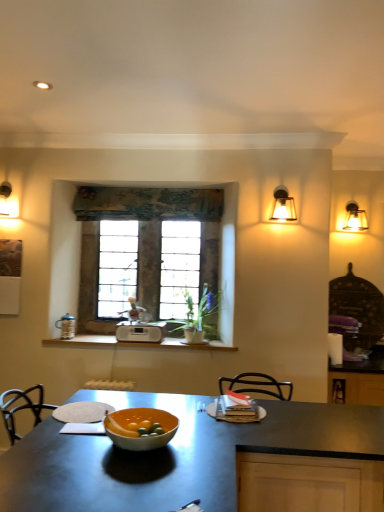
Question: Is matte orange bowl at center at the left side of white plastic radio at center?

Choices:
 (A) no
 (B) yes

Answer: (A)

Question: Could white plastic radio at center be considered to be inside matte orange bowl at center?

Choices:
 (A) no
 (B) yes

Answer: (A)

Question: Does matte orange bowl at center have a greater height compared to white plastic radio at center?

Choices:
 (A) no
 (B) yes

Answer: (A)

Question: Is matte orange bowl at center positioned behind white plastic radio at center?

Choices:
 (A) yes
 (B) no

Answer: (B)

Question: Is matte orange bowl at center oriented towards white plastic radio at center?

Choices:
 (A) yes
 (B) no

Answer: (B)

Question: Relative to stone textured window at center, is matte glass sconce at upper right in front or behind?

Choices:
 (A) front
 (B) behind

Answer: (A)

Question: Considering the positions of matte glass sconce at upper right and stone textured window at center in the image, is matte glass sconce at upper right wider or thinner than stone textured window at center?

Choices:
 (A) thin
 (B) wide

Answer: (B)

Question: From the image's perspective, is matte glass sconce at upper right positioned above or below stone textured window at center?

Choices:
 (A) above
 (B) below

Answer: (A)

Question: Do you think matte glass sconce at upper right is within stone textured window at center, or outside of it?

Choices:
 (A) outside
 (B) inside

Answer: (A)

Question: Is point (180, 281) closer or farther from the camera than point (139, 217)?

Choices:
 (A) farther
 (B) closer

Answer: (A)

Question: From the image's perspective, relative to textured fabric curtain at center, is stone textured window at center above or below?

Choices:
 (A) below
 (B) above

Answer: (A)

Question: From a real-world perspective, is stone textured window at center above or below textured fabric curtain at center?

Choices:
 (A) above
 (B) below

Answer: (B)

Question: Based on their sizes in the image, would you say stone textured window at center is bigger or smaller than textured fabric curtain at center?

Choices:
 (A) big
 (B) small

Answer: (A)

Question: Is white plastic radio at center spatially inside stone textured window at center, or outside of it?

Choices:
 (A) outside
 (B) inside

Answer: (A)

Question: Looking at the image, does white plastic radio at center seem bigger or smaller compared to stone textured window at center?

Choices:
 (A) small
 (B) big

Answer: (A)